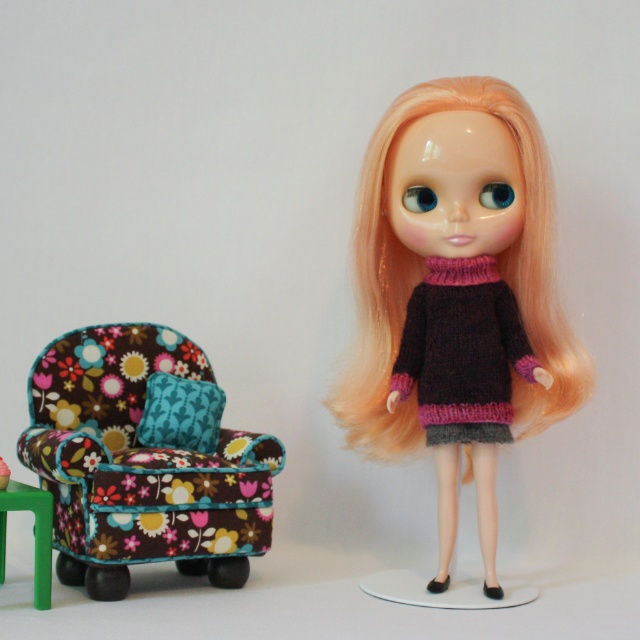
Question: Which point is closer to the camera taking this photo?

Choices:
 (A) (404, 109)
 (B) (20, 490)

Answer: (B)

Question: Is blondehair at right to the left of green plastic stool at lower left from the viewer's perspective?

Choices:
 (A) yes
 (B) no

Answer: (B)

Question: Where is blondehair at right located in relation to black knitted sweater at center in the image?

Choices:
 (A) above
 (B) below

Answer: (A)

Question: Which object is positioned farthest from the green plastic stool at lower left?

Choices:
 (A) floral fabric armchair at left
 (B) blondehair at right
 (C) black knitted sweater at center

Answer: (C)

Question: Is blondehair at right positioned at the back of green plastic stool at lower left?

Choices:
 (A) no
 (B) yes

Answer: (B)

Question: Which object appears farthest from the camera in this image?

Choices:
 (A) black knitted sweater at center
 (B) green plastic stool at lower left
 (C) floral fabric armchair at left

Answer: (A)